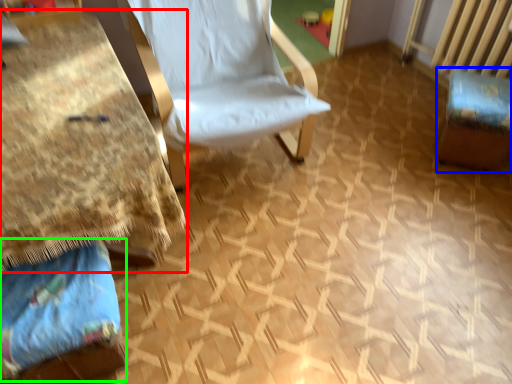
Question: Considering the real-world distances, which object is closest to table (highlighted by a red box)? swivel chair (highlighted by a blue box) or fabric (highlighted by a green box).

Choices:
 (A) swivel chair
 (B) fabric

Answer: (B)